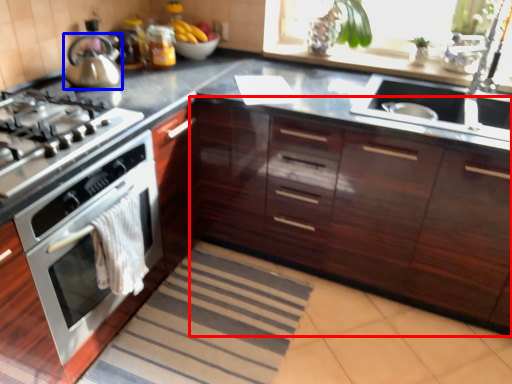
Question: Which object is closer to the camera taking this photo, cabinetry (highlighted by a red box) or kitchen appliance (highlighted by a blue box)?

Choices:
 (A) cabinetry
 (B) kitchen appliance

Answer: (A)